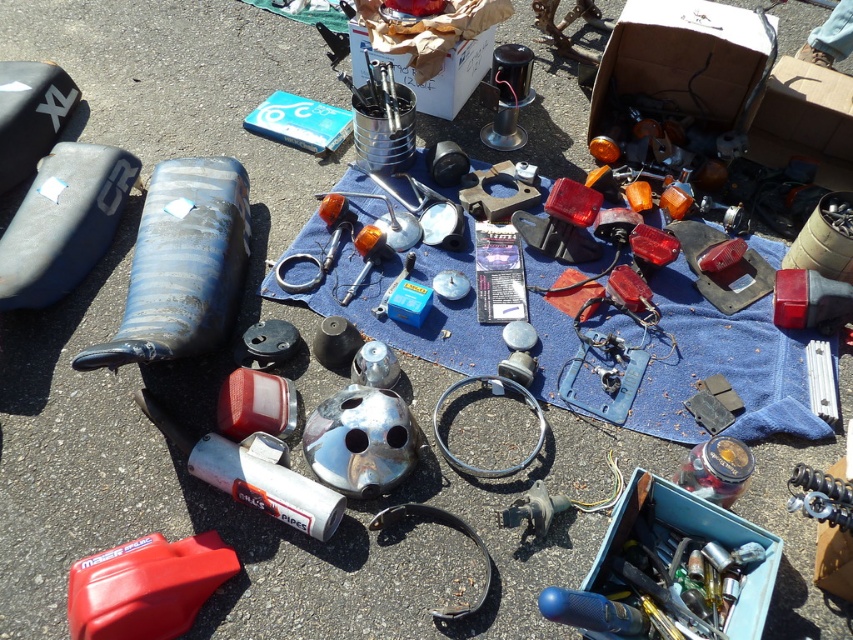
You are a mechanic looking for a toolbox to repair a motorcycle part. You see the metallic blue toolbox at lower right and the blue matte fuel tank at left. Which object is closer to you?

The metallic blue toolbox at lower right is positioned under the blue matte fuel tank at left, so the blue matte fuel tank at left is closer to you.

You are setting up a display for a motorcycle parts sale. You have a blue fabric at center and a metallic blue toolbox at lower right. Which item should you place closer to the edge of the table to ensure stability?

The metallic blue toolbox at lower right should be placed closer to the edge of the table because it is narrower than the blue fabric at center, reducing the risk of it falling off.